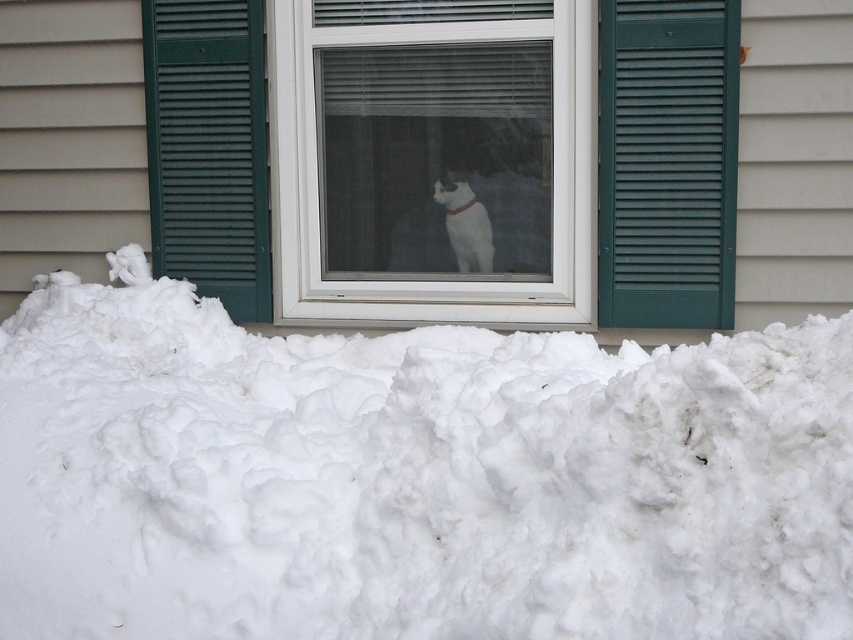
Who is higher up, white fluffy snow at center or green louvered shutter at center?

green louvered shutter at center is higher up.

Is white fluffy snow at center taller than green louvered shutter at center?

No, white fluffy snow at center is not taller than green louvered shutter at center.

Describe the element at coordinates (415, 480) in the screenshot. The width and height of the screenshot is (853, 640). I see `white fluffy snow at center` at that location.

Find the location of a particular element. white fluffy snow at center is located at coordinates (415, 480).

Can you confirm if white plastic window at center is smaller than green painted wood shutter at right?

No, white plastic window at center is not smaller than green painted wood shutter at right.

Who is taller, white plastic window at center or green painted wood shutter at right?

Standing taller between the two is white plastic window at center.

Is point (323, 273) positioned before point (709, 10)?

No, it is not.

Find the location of a particular element. white plastic window at center is located at coordinates (433, 160).

Can you confirm if white plastic window at center is smaller than green louvered shutter at center?

No.

Based on the photo, can you confirm if white plastic window at center is thinner than green louvered shutter at center?

No, white plastic window at center is not thinner than green louvered shutter at center.

You are a GUI agent. You are given a task and a screenshot of the screen. Output one action in this format:
    pyautogui.click(x=<x>, y=<y>)
    Task: Click on the white plastic window at center
    The height and width of the screenshot is (640, 853).
    Given the screenshot: What is the action you would take?
    [433, 160]